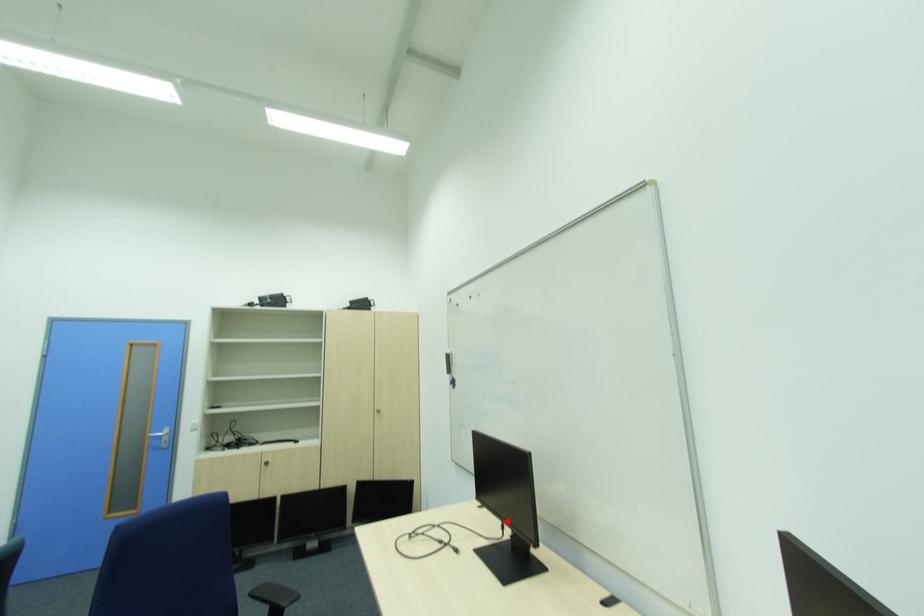
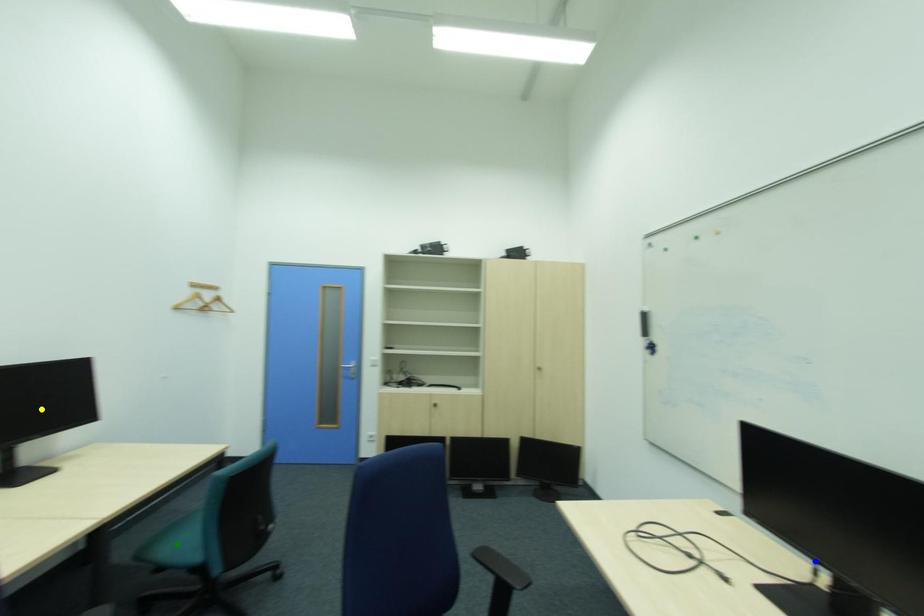
Question: I am providing you with two images of the same scene from different viewpoints. A red point is marked on the first image. You are given multiple points on the second image. Can you choose the point in image 2 that corresponds to the point in image 1?

Choices:
 (A) yellow point
 (B) blue point
 (C) green point

Answer: (B)